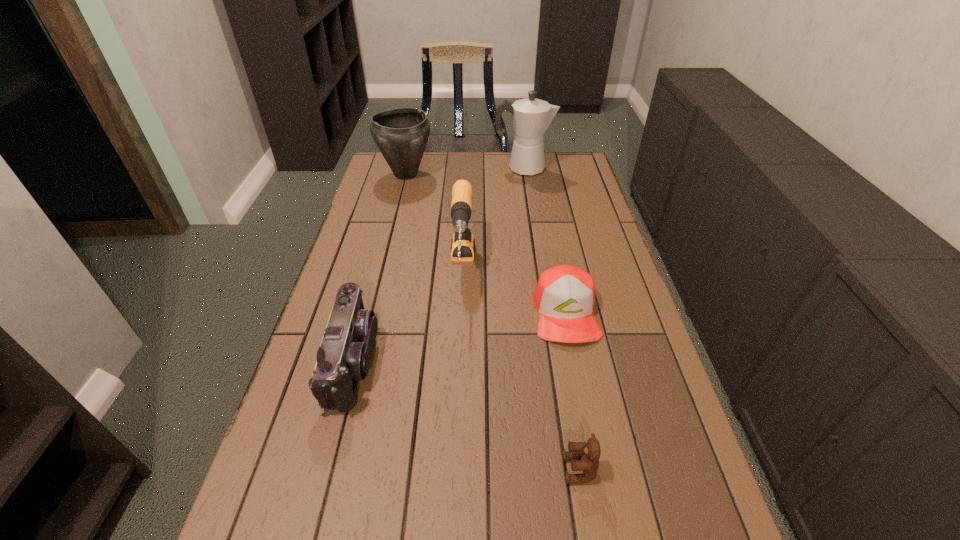
You are a GUI agent. You are given a task and a screenshot of the screen. Output one action in this format:
    pyautogui.click(x=<x>, y=<y>)
    Task: Click on the vacant point located on the front-facing side of the baseball cap
    Image resolution: width=960 pixels, height=540 pixels.
    Given the screenshot: What is the action you would take?
    pyautogui.click(x=610, y=535)

I want to click on vacant space located on the face of the nearest object, so click(x=537, y=469).

Identify the location of free location located on the face of the nearest object. (456, 469).

Image resolution: width=960 pixels, height=540 pixels. Identify the location of vacant space situated 0.200m on the face of the nearest object. (456, 469).

Where is `coffeepot present at the far edge`? The width and height of the screenshot is (960, 540). coffeepot present at the far edge is located at coordinates (531, 117).

The width and height of the screenshot is (960, 540). Identify the location of urn present at the far edge. (401, 134).

You are a GUI agent. You are given a task and a screenshot of the screen. Output one action in this format:
    pyautogui.click(x=<x>, y=<y>)
    Task: Click on the urn at the left edge
    
    Given the screenshot: What is the action you would take?
    pyautogui.click(x=401, y=134)

Locate an element on the screen. The width and height of the screenshot is (960, 540). camcorder situated at the left edge is located at coordinates (345, 352).

The height and width of the screenshot is (540, 960). Identify the location of coffeepot that is at the right edge. (531, 117).

The width and height of the screenshot is (960, 540). I want to click on baseball cap that is at the right edge, so click(564, 297).